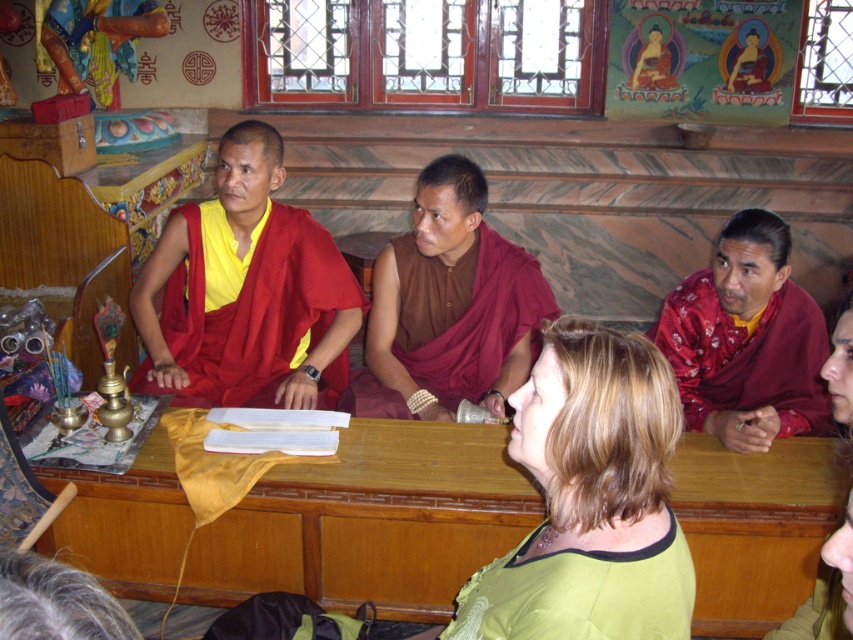
You are an interior designer observing the scene. You need to place a small table between the matte red robe at center and the red silk robe at right. Based on their positions, where should the table be placed?

The matte red robe at center is above the red silk robe at right, so the table should be placed between them horizontally since the vertical position difference won

You are standing at the point marked by the coordinates point (341, 353). You want to move to the door located at the far end of the room. The distance from your current position to the door is 15 feet. If you walk straight ahead, will you reach the door before walking 10 feet?

The distance from point (341, 353) to the door is 15 feet. Since you are asking if you can reach it before walking 10 feet, the answer is no because 10 feet is less than the required 15 feet to reach the door.